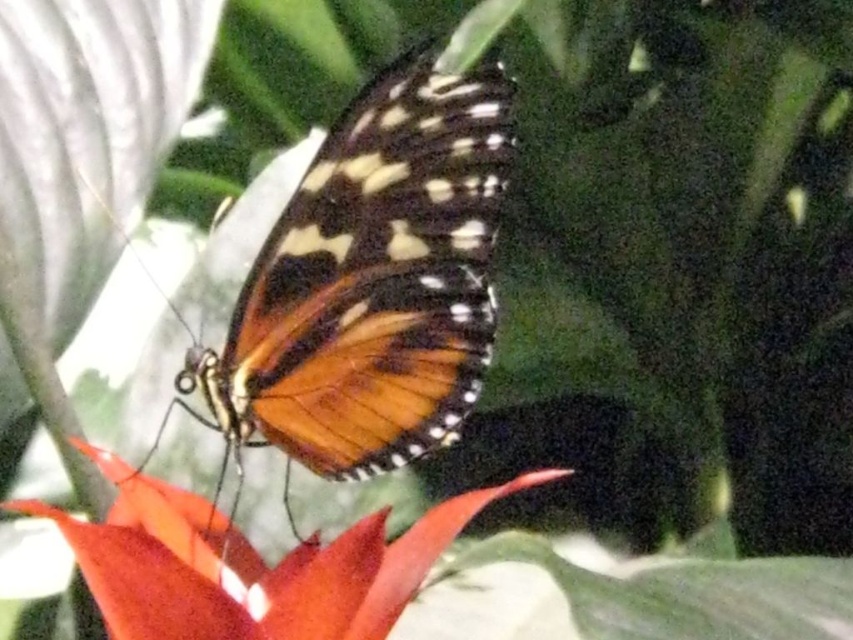
You are an entomologist observing a butterfly on a flower. You notice a point at coordinates (369, 284). What is located at this point?

The point at coordinates (369, 284) is where the orange iridescent wings at center are located.